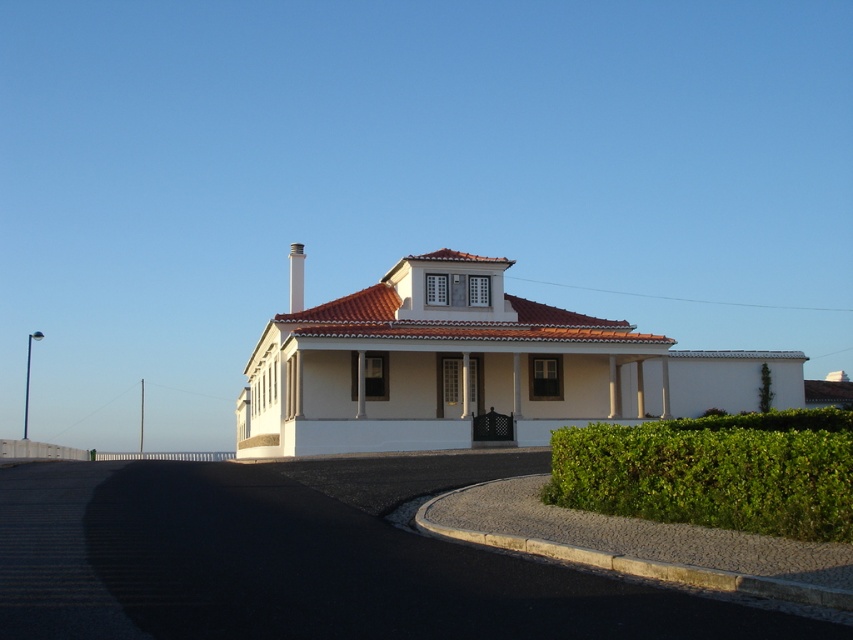
Is black asphalt at center below green leafy hedge at lower right?

Correct, black asphalt at center is located below green leafy hedge at lower right.

Does point (486, 616) come closer to viewer compared to point (776, 456)?

Yes, point (486, 616) is in front of point (776, 456).

Where is `black asphalt at center`? This screenshot has height=640, width=853. black asphalt at center is located at coordinates (299, 568).

Is point (274, 513) positioned in front of point (302, 268)?

Yes, point (274, 513) is closer to viewer.

Describe the element at coordinates (299, 568) in the screenshot. I see `black asphalt at center` at that location.

Where is `black asphalt at center`? Image resolution: width=853 pixels, height=640 pixels. black asphalt at center is located at coordinates (299, 568).

In the scene shown: Between green leafy hedge at lower right and white smooth chimney at center, which one appears on the right side from the viewer's perspective?

green leafy hedge at lower right is more to the right.

Between green leafy hedge at lower right and white smooth chimney at center, which one appears on the left side from the viewer's perspective?

white smooth chimney at center is more to the left.

Is point (756, 416) behind point (299, 250)?

That is False.

In order to click on green leafy hedge at lower right in this screenshot , I will do `click(714, 472)`.